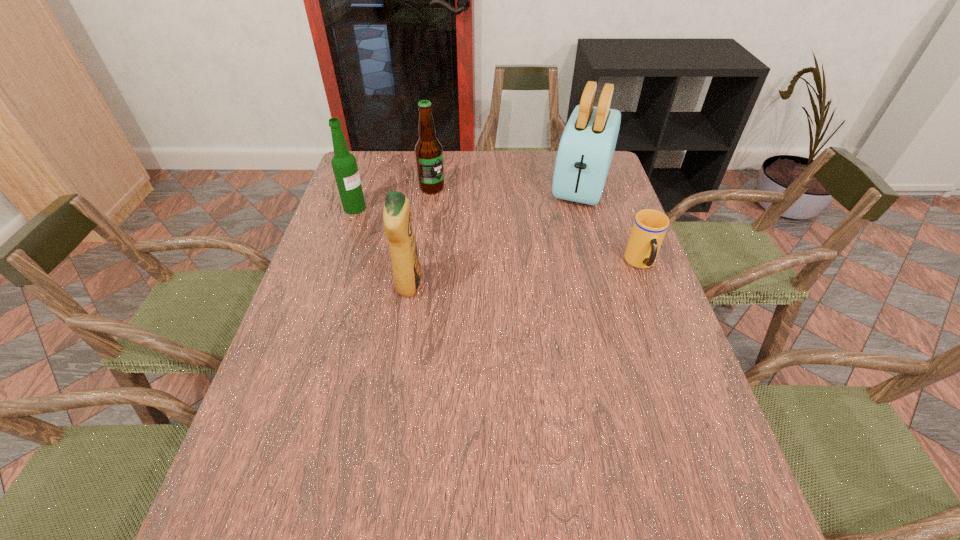
Identify the location of detergent. (397, 220).

Locate an element on the screen. The width and height of the screenshot is (960, 540). the shortest object is located at coordinates (649, 228).

I want to click on toaster, so click(x=587, y=145).

Find the location of a particular element. This screenshot has width=960, height=540. the right beer bottle is located at coordinates (428, 150).

The width and height of the screenshot is (960, 540). Identify the location of the left beer bottle. (344, 164).

Where is `the leftmost object`? The width and height of the screenshot is (960, 540). the leftmost object is located at coordinates (344, 164).

The height and width of the screenshot is (540, 960). I want to click on vacant space located 0.190m on the label of the detergent, so click(x=494, y=285).

Locate an element on the screen. The height and width of the screenshot is (540, 960). free location located 0.370m on the side of the cup with the handle is located at coordinates (694, 406).

You are a GUI agent. You are given a task and a screenshot of the screen. Output one action in this format:
    pyautogui.click(x=<x>, y=<y>)
    Task: Click on the free region located on the side of the toaster with the lever
    
    Given the screenshot: What is the action you would take?
    pyautogui.click(x=568, y=235)

Locate an element on the screen. vacant area situated on the side of the toaster with the lever is located at coordinates (558, 266).